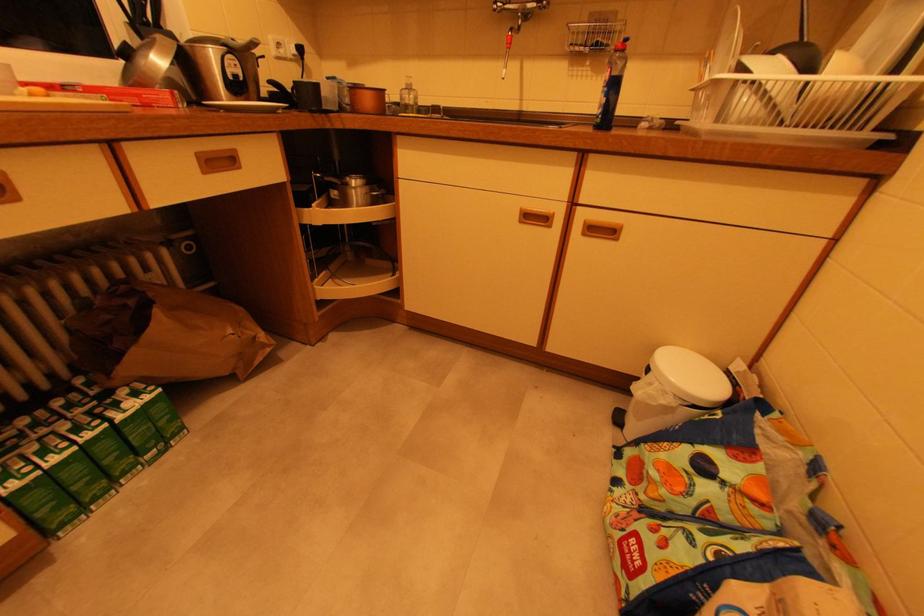
What do you see at coordinates (703, 557) in the screenshot?
I see `the blue bag handle` at bounding box center [703, 557].